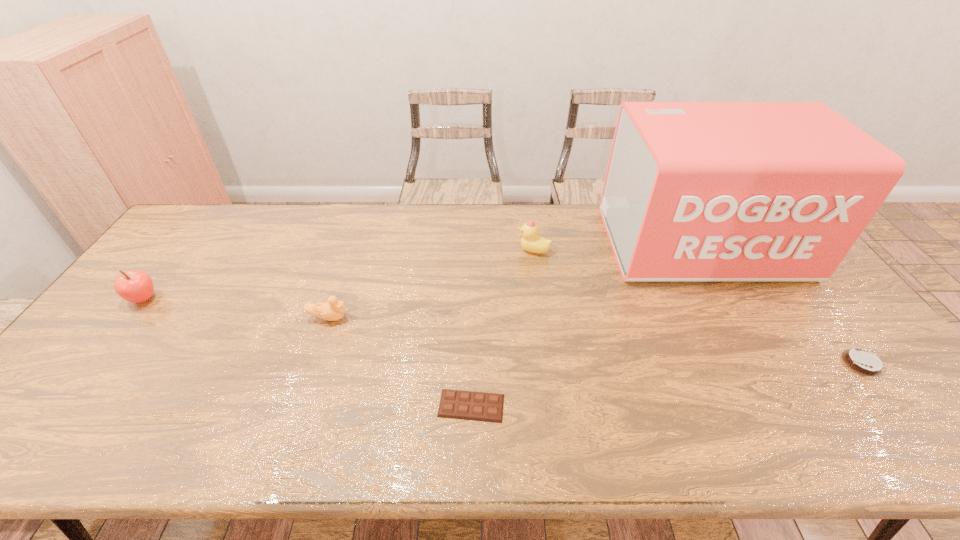
Identify the location of the third object from left to right. (467, 405).

Locate an element on the screen. The image size is (960, 540). free region located on the surface of the box where the text is embossed is located at coordinates (774, 370).

Find the location of a particular element. This screenshot has width=960, height=540. free point located on the front-facing side of the right duckling is located at coordinates (437, 251).

The image size is (960, 540). Find the location of `free space located 0.230m on the front-facing side of the right duckling`. free space located 0.230m on the front-facing side of the right duckling is located at coordinates tap(446, 251).

Where is `vacant area situated on the front-facing side of the right duckling`? This screenshot has height=540, width=960. vacant area situated on the front-facing side of the right duckling is located at coordinates (428, 251).

At what (x,y) coordinates should I click in order to perform the action: click on free space located on the right of the apple. Please return your answer as a coordinate pair (x, y). This screenshot has width=960, height=540. Looking at the image, I should click on (207, 299).

Find the location of `vacant area situated 0.190m on the face of the shorter duckling`. vacant area situated 0.190m on the face of the shorter duckling is located at coordinates (417, 318).

The height and width of the screenshot is (540, 960). I want to click on vacant space located 0.070m on the front of the chocolate cake, so click(893, 404).

The height and width of the screenshot is (540, 960). What are the coordinates of `vacant area situated 0.370m on the left of the shortest object` in the screenshot? It's located at (278, 406).

Image resolution: width=960 pixels, height=540 pixels. What are the coordinates of `box present at the far edge` in the screenshot? It's located at (694, 191).